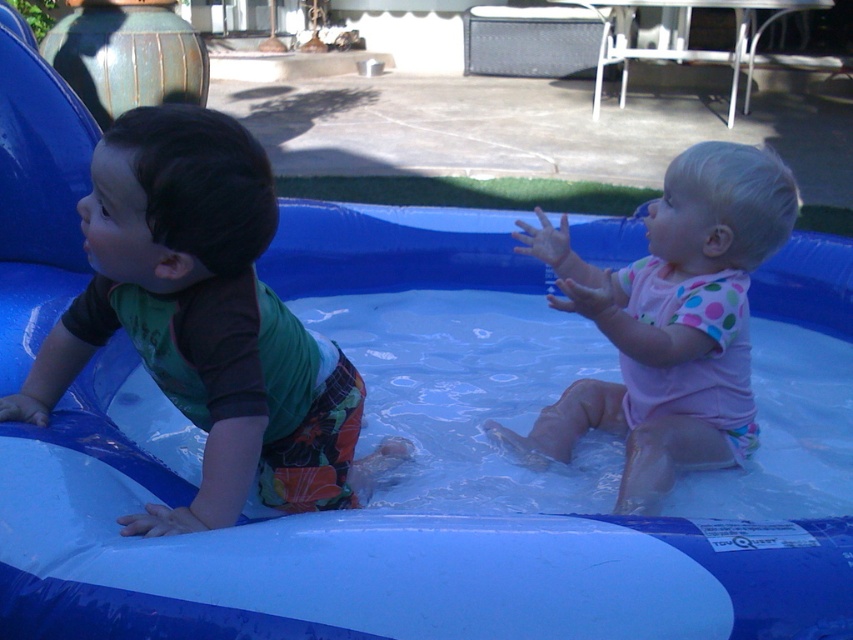
Question: Can you confirm if blue rubber pool at center is positioned above pink polka dot swimsuit at center?

Choices:
 (A) yes
 (B) no

Answer: (B)

Question: Which object appears farthest from the camera in this image?

Choices:
 (A) green fabric shirt at left
 (B) blue rubber pool at center

Answer: (A)

Question: Can you confirm if green fabric shirt at left is positioned above pink polka dot swimsuit at center?

Choices:
 (A) yes
 (B) no

Answer: (B)

Question: Does blue rubber pool at center have a smaller size compared to green fabric shirt at left?

Choices:
 (A) yes
 (B) no

Answer: (B)

Question: Estimate the real-world distances between objects in this image. Which object is closer to the pink polka dot swimsuit at center?

Choices:
 (A) blue rubber pool at center
 (B) green fabric shirt at left

Answer: (B)

Question: Which point is farther to the camera?

Choices:
 (A) green fabric shirt at left
 (B) blue rubber pool at center

Answer: (A)